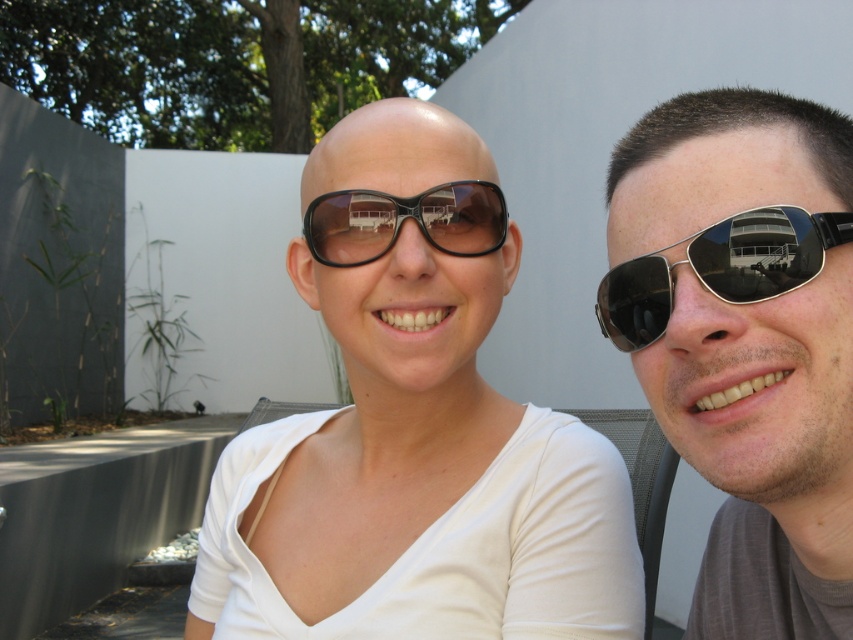
Question: Does matte black sunglasses at center come behind sunglasses at right?

Choices:
 (A) yes
 (B) no

Answer: (A)

Question: Which of these objects is positioned farthest from the black matte sunglasses at center?

Choices:
 (A) metallic aviator sunglasses at right
 (B) sunglasses at right

Answer: (A)

Question: Which of the following is the farthest from the observer?

Choices:
 (A) (784, 525)
 (B) (558, 605)
 (C) (318, 214)
 (D) (758, 284)

Answer: (C)

Question: Is matte black sunglasses at center above sunglasses at right?

Choices:
 (A) yes
 (B) no

Answer: (B)

Question: Can you confirm if matte black sunglasses at center is bigger than black matte sunglasses at center?

Choices:
 (A) yes
 (B) no

Answer: (A)

Question: Which object appears farthest from the camera in this image?

Choices:
 (A) black matte sunglasses at center
 (B) sunglasses at right
 (C) matte black sunglasses at center

Answer: (A)